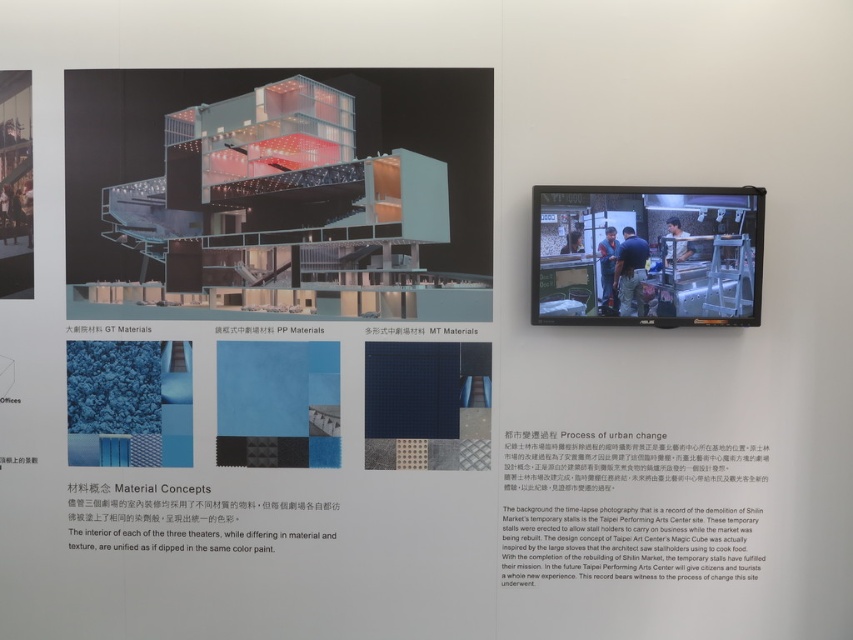
You are an architect examining the exhibition display. You see the blue jeans at center and the blue fabric at upper center. Which material sample is positioned closer to you?

The blue jeans at center is closer to the viewer than the blue fabric at upper center.